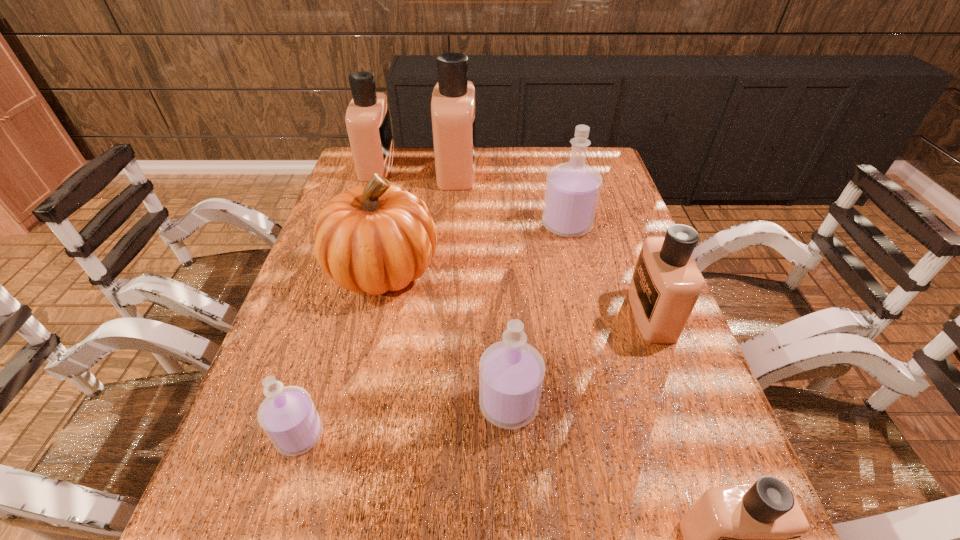
Where is `the third closest purple perfume to the pumpkin`? Image resolution: width=960 pixels, height=540 pixels. the third closest purple perfume to the pumpkin is located at coordinates coord(572,191).

I want to click on vacant space that satisfies the following two spatial constraints: 1. on the back side of the biggest purple perfume; 2. on the front label of the third perfume from left to right, so click(x=554, y=170).

Find the location of a particular element. Image resolution: width=960 pixels, height=540 pixels. vacant space that satisfies the following two spatial constraints: 1. on the back side of the biggest purple perfume; 2. on the front label of the third smallest beige perfume is located at coordinates point(553,165).

Where is `vacant space that satisfies the following two spatial constraints: 1. on the front label of the leftmost beige perfume; 2. on the left side of the fourth perfume from left to right`? Image resolution: width=960 pixels, height=540 pixels. vacant space that satisfies the following two spatial constraints: 1. on the front label of the leftmost beige perfume; 2. on the left side of the fourth perfume from left to right is located at coordinates (299, 404).

At what (x,y) coordinates should I click in order to perform the action: click on free space that satisfies the following two spatial constraints: 1. on the front label of the tallest object; 2. on the front side of the pumpkin. Please return your answer as a coordinate pair (x, y). This screenshot has height=540, width=960. Looking at the image, I should click on pyautogui.click(x=449, y=268).